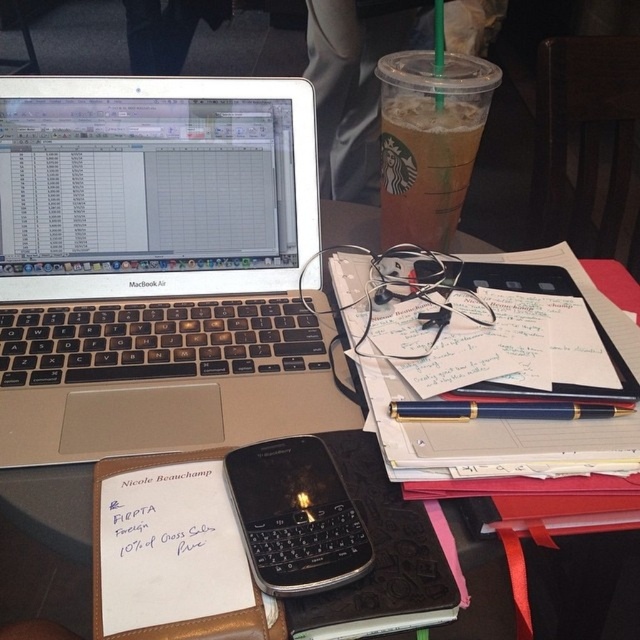
Measure the distance from silver metallic laptop at upper left to black plastic phone at center.

silver metallic laptop at upper left and black plastic phone at center are 8.56 inches apart.

Where is `silver metallic laptop at upper left`? The height and width of the screenshot is (640, 640). silver metallic laptop at upper left is located at coordinates (157, 268).

At what (x,y) coordinates should I click in order to perform the action: click on silver metallic laptop at upper left. Please return your answer as a coordinate pair (x, y). The image size is (640, 640). Looking at the image, I should click on (157, 268).

The width and height of the screenshot is (640, 640). Find the location of `silver metallic laptop at upper left`. silver metallic laptop at upper left is located at coordinates (157, 268).

Does translucent plastic cup at upper center have a smaller size compared to blue metallic pen at center?

Actually, translucent plastic cup at upper center might be larger than blue metallic pen at center.

Is translucent plastic cup at upper center thinner than blue metallic pen at center?

Yes.

Which is in front, point (435, 227) or point (572, 404)?

Point (572, 404) is more forward.

At what (x,y) coordinates should I click in order to perform the action: click on translucent plastic cup at upper center. Please return your answer as a coordinate pair (x, y). This screenshot has height=640, width=640. Looking at the image, I should click on (428, 141).

Is point (164, 538) behind point (557, 512)?

No, it is in front of (557, 512).

Between white paper at center and black plastic laptop at upper left, which one is positioned lower?

black plastic laptop at upper left is lower down.

Between point (266, 604) and point (506, 497), which one is positioned behind?

Positioned behind is point (506, 497).

Locate an element on the screen. This screenshot has width=640, height=640. white paper at center is located at coordinates (172, 554).